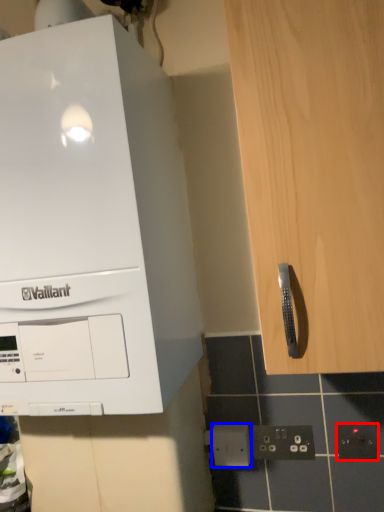
Question: Which object appears farthest to the camera in this image, electric outlet (highlighted by a red box) or electric outlet (highlighted by a blue box)?

Choices:
 (A) electric outlet
 (B) electric outlet

Answer: (B)